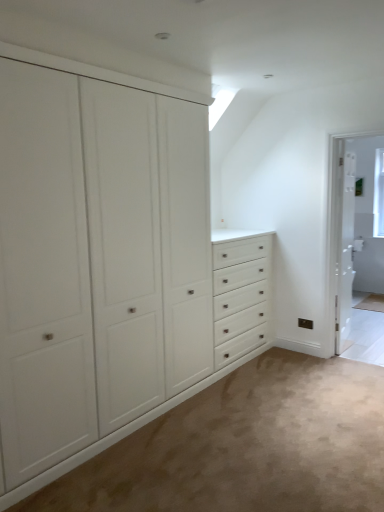
Where is `free location above white wooden screen door at right (from a real-world perspective)`? The height and width of the screenshot is (512, 384). free location above white wooden screen door at right (from a real-world perspective) is located at coordinates (354, 121).